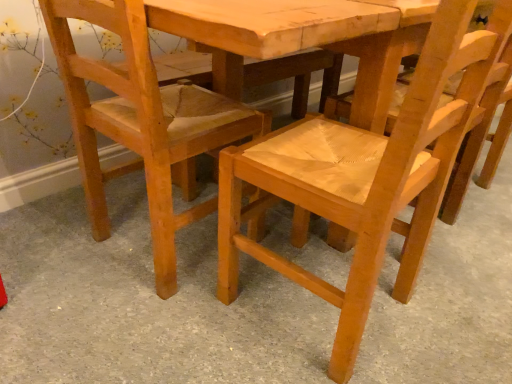
Where is `free spot in front of light brown wood chair at lower left, the second chair positioned from the right`? The height and width of the screenshot is (384, 512). free spot in front of light brown wood chair at lower left, the second chair positioned from the right is located at coordinates (140, 329).